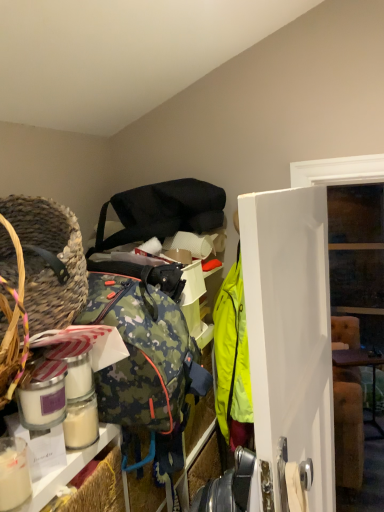
What do you see at coordinates (362, 365) in the screenshot?
I see `brown wooden table at right` at bounding box center [362, 365].

Where is `braided straw basket at left`? This screenshot has width=384, height=512. braided straw basket at left is located at coordinates pyautogui.click(x=49, y=260).

How different are the orientations of brown wooden table at right and matte black shoulder bag at upper center in degrees?

brown wooden table at right and matte black shoulder bag at upper center are facing 69.2 degrees away from each other.

From a real-world perspective, is brown wooden table at right located higher than matte black shoulder bag at upper center?

No.

Is brown wooden table at right outside of matte black shoulder bag at upper center?

Indeed, brown wooden table at right is completely outside matte black shoulder bag at upper center.

Based on their positions, is brown wooden table at right located to the left or right of matte black shoulder bag at upper center?

Based on their positions, brown wooden table at right is located to the right of matte black shoulder bag at upper center.

Who is smaller, brown wooden table at right or braided straw basket at left?

Smaller between the two is braided straw basket at left.

How many degrees apart are the facing directions of brown wooden table at right and braided straw basket at left?

The angle between the facing direction of brown wooden table at right and the facing direction of braided straw basket at left is 69.2 degrees.

Is brown wooden table at right in front of braided straw basket at left?

No, the depth of brown wooden table at right is greater than that of braided straw basket at left.

From the image's perspective, which one is positioned higher, white glossy door at center or brown wooden table at right?

white glossy door at center is shown above in the image.

Is white glossy door at center oriented towards brown wooden table at right?

No.

Can you confirm if white glossy door at center is smaller than brown wooden table at right?

Actually, white glossy door at center might be larger than brown wooden table at right.

Is matte black shoulder bag at upper center looking in the opposite direction of white glossy door at center?

No, matte black shoulder bag at upper center is not facing away from white glossy door at center.

Is matte black shoulder bag at upper center wider or thinner than white glossy door at center?

Considering their sizes, matte black shoulder bag at upper center looks broader than white glossy door at center.

Considering the sizes of matte black shoulder bag at upper center and white glossy door at center in the image, is matte black shoulder bag at upper center taller or shorter than white glossy door at center?

In the image, matte black shoulder bag at upper center appears to be shorter than white glossy door at center.

Is matte black shoulder bag at upper center behind white glossy door at center?

Yes.

From a real-world perspective, which is physically above, braided straw basket at left or white glossy door at center?

braided straw basket at left, from a real-world perspective.

Considering their positions, is braided straw basket at left located in front of or behind white glossy door at center?

Visually, braided straw basket at left is located in front of white glossy door at center.

Is braided straw basket at left not close to white glossy door at center?

That's not correct — braided straw basket at left is a little close to white glossy door at center.

Which is more to the right, braided straw basket at left or white glossy door at center?

white glossy door at center.

Would you say matte black shoulder bag at upper center is outside braided straw basket at left?

Answer: Yes, matte black shoulder bag at upper center is not within braided straw basket at left.

Based on the photo, does matte black shoulder bag at upper center have a larger size compared to braided straw basket at left?

Yes, matte black shoulder bag at upper center is bigger than braided straw basket at left.

Between matte black shoulder bag at upper center and braided straw basket at left, which one has larger width?

Wider between the two is matte black shoulder bag at upper center.

From a real-world perspective, is matte black shoulder bag at upper center positioned over braided straw basket at left based on gravity?

Yes, from a real-world perspective, matte black shoulder bag at upper center is over braided straw basket at left

Looking at this image, from a real-world perspective, is white glossy door at center physically located above or below braided straw basket at left?

From a real-world perspective, white glossy door at center is physically below braided straw basket at left.

Is white glossy door at center not near braided straw basket at left?

No.

The height and width of the screenshot is (512, 384). There is a white glossy door at center. In order to click on basket above it (from a real-world perspective) in this screenshot , I will do `click(49, 260)`.

Which of these two, white glossy door at center or braided straw basket at left, is bigger?

white glossy door at center.

Where is `shoulder bag that appears in front of the brown wooden table at right`? shoulder bag that appears in front of the brown wooden table at right is located at coordinates (163, 211).

The image size is (384, 512). What are the coordinates of `basket above the brown wooden table at right (from the image's perspective)` in the screenshot? It's located at (49, 260).

Based on their spatial positions, is matte black shoulder bag at upper center or white glossy door at center further from brown wooden table at right?

The object further to brown wooden table at right is matte black shoulder bag at upper center.

Considering their positions, is white glossy door at center positioned further to brown wooden table at right than braided straw basket at left?

braided straw basket at left lies further to brown wooden table at right than the other object.

Which object lies further to the anchor point braided straw basket at left, matte black shoulder bag at upper center or white glossy door at center?

white glossy door at center is positioned further to the anchor braided straw basket at left.

Estimate the real-world distances between objects in this image. Which object is further from matte black shoulder bag at upper center, white glossy door at center or brown wooden table at right?

The object further to matte black shoulder bag at upper center is brown wooden table at right.

Looking at the image, which one is located closer to white glossy door at center, braided straw basket at left or brown wooden table at right?

braided straw basket at left is closer to white glossy door at center.

When comparing their distances from matte black shoulder bag at upper center, does white glossy door at center or braided straw basket at left seem further?

Among the two, white glossy door at center is located further to matte black shoulder bag at upper center.

Considering their positions, is brown wooden table at right positioned further to braided straw basket at left than white glossy door at center?

brown wooden table at right lies further to braided straw basket at left than the other object.

Based on their spatial positions, is brown wooden table at right or matte black shoulder bag at upper center further from braided straw basket at left?

brown wooden table at right lies further to braided straw basket at left than the other object.

Where is `shoulder bag located between white glossy door at center and brown wooden table at right in the depth direction`? The image size is (384, 512). shoulder bag located between white glossy door at center and brown wooden table at right in the depth direction is located at coordinates (163, 211).

This screenshot has height=512, width=384. Identify the location of door positioned between braided straw basket at left and matte black shoulder bag at upper center from near to far. (289, 337).

Where is `door between braided straw basket at left and brown wooden table at right in the front-back direction`? door between braided straw basket at left and brown wooden table at right in the front-back direction is located at coordinates (289, 337).

Identify the location of shoulder bag between braided straw basket at left and brown wooden table at right along the z-axis. This screenshot has height=512, width=384. (163, 211).